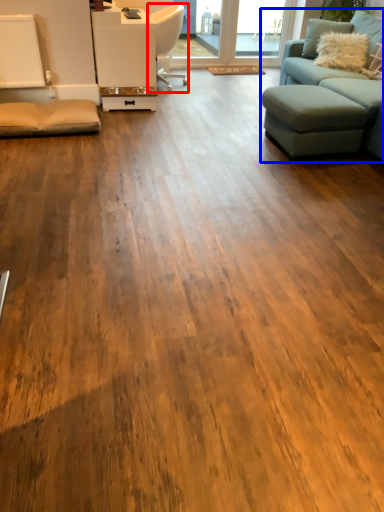
Question: Among these objects, which one is nearest to the camera, chair (highlighted by a red box) or studio couch (highlighted by a blue box)?

Choices:
 (A) chair
 (B) studio couch

Answer: (B)